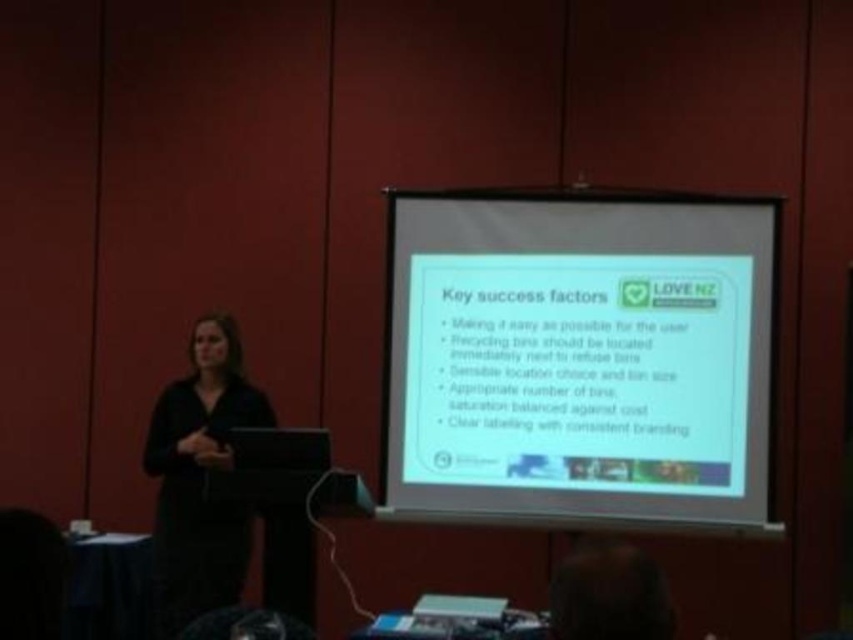
Question: Among these points, which one is nearest to the camera?

Choices:
 (A) (190, 531)
 (B) (508, 404)

Answer: (B)

Question: Can you confirm if white paper at center is bigger than black matte dress at left?

Choices:
 (A) yes
 (B) no

Answer: (A)

Question: Is white paper at center to the right of black matte dress at left from the viewer's perspective?

Choices:
 (A) yes
 (B) no

Answer: (A)

Question: Does white paper at center lie in front of black matte dress at left?

Choices:
 (A) no
 (B) yes

Answer: (B)

Question: Which point is farther from the camera taking this photo?

Choices:
 (A) (766, 224)
 (B) (224, 392)

Answer: (B)

Question: Which point is closer to the camera?

Choices:
 (A) white paper at center
 (B) black matte dress at left

Answer: (A)